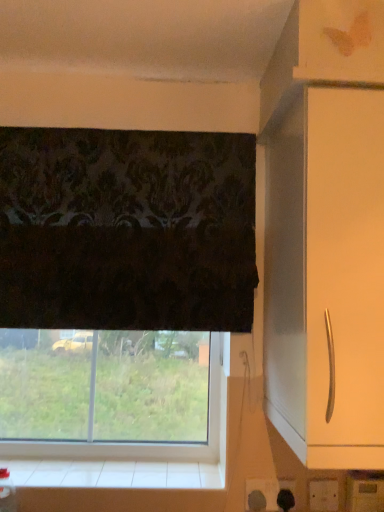
The width and height of the screenshot is (384, 512). I want to click on white glossy cabinet handle at right, so click(344, 279).

Image resolution: width=384 pixels, height=512 pixels. What do you see at coordinates (145, 444) in the screenshot?
I see `transparent glass window at lower center` at bounding box center [145, 444].

Locate an element on the screen. white tile at lower center is located at coordinates (113, 465).

Which object is positioned more to the right, transparent glass window at lower center or white tile at lower center?

From the viewer's perspective, white tile at lower center appears more on the right side.

From a real-world perspective, is transparent glass window at lower center under white tile at lower center?

No, from a real-world perspective, transparent glass window at lower center is not beneath white tile at lower center.

Is transparent glass window at lower center in front of or behind white tile at lower center in the image?

Visually, transparent glass window at lower center is located behind white tile at lower center.

Is transparent glass window at lower center beside white tile at lower center?

Yes, the surface of transparent glass window at lower center is in contact with white tile at lower center.

Which is behind, point (85, 476) or point (136, 452)?

The point (136, 452) is more distant.

Can we say white tile at lower center lies outside transparent glass window at lower center?

Yes, white tile at lower center is not within transparent glass window at lower center.

Looking at the image, does white tile at lower center seem bigger or smaller compared to transparent glass window at lower center?

Clearly, white tile at lower center is smaller in size than transparent glass window at lower center.

From a real-world perspective, is white tile at lower center physically above transparent glass window at lower center?

No.

Between white glossy cabinet handle at right and white tile at lower center, which one has less height?

With less height is white tile at lower center.

Are white glossy cabinet handle at right and white tile at lower center located far from each other?

white glossy cabinet handle at right is actually quite close to white tile at lower center.

Which of these two, white glossy cabinet handle at right or white tile at lower center, is bigger?

white glossy cabinet handle at right.

From the image's perspective, is white glossy cabinet handle at right located above white tile at lower center?

Correct, white glossy cabinet handle at right appears higher than white tile at lower center in the image.

Can you confirm if transparent glass window at lower center is thinner than white glossy cabinet handle at right?

Yes.

Considering the sizes of objects transparent glass window at lower center and white glossy cabinet handle at right in the image provided, who is smaller, transparent glass window at lower center or white glossy cabinet handle at right?

transparent glass window at lower center.

Between point (184, 448) and point (366, 272), which one is positioned behind?

The point (184, 448) is more distant.

Measure the distance from transparent glass window at lower center to white glossy cabinet handle at right.

They are 66.43 centimeters apart.

How many degrees apart are the facing directions of white tile at lower center and white glossy cabinet handle at right?

They differ by 1.06 degrees in their facing directions.

Which of these two, white tile at lower center or white glossy cabinet handle at right, stands taller?

With more height is white glossy cabinet handle at right.

The image size is (384, 512). In order to click on screen door that appears above the white tile at lower center (from the image's perspective) in this screenshot , I will do `click(344, 279)`.

From a real-world perspective, is white glossy cabinet handle at right positioned under transparent glass window at lower center based on gravity?

No, from a real-world perspective, white glossy cabinet handle at right is not beneath transparent glass window at lower center.

Between white glossy cabinet handle at right and transparent glass window at lower center, which one appears on the left side from the viewer's perspective?

transparent glass window at lower center is more to the left.

Is white glossy cabinet handle at right placed right next to transparent glass window at lower center?

No.

What are the coordinates of `window that is behind the white glossy cabinet handle at right` in the screenshot? It's located at (145, 444).

Locate an element on the screen. window sill on the right of transparent glass window at lower center is located at coordinates (113, 465).

I want to click on window sill below the transparent glass window at lower center (from a real-world perspective), so click(x=113, y=465).

Estimate the real-world distances between objects in this image. Which object is further from white glossy cabinet handle at right, white tile at lower center or transparent glass window at lower center?

white tile at lower center.

Based on their spatial positions, is transparent glass window at lower center or white glossy cabinet handle at right further from white tile at lower center?

white glossy cabinet handle at right is further to white tile at lower center.

Estimate the real-world distances between objects in this image. Which object is closer to transparent glass window at lower center, white tile at lower center or white glossy cabinet handle at right?

white tile at lower center is closer to transparent glass window at lower center.

From the image, which object appears to be farther from transparent glass window at lower center, white glossy cabinet handle at right or white tile at lower center?

Based on the image, white glossy cabinet handle at right appears to be further to transparent glass window at lower center.

Considering their positions, is transparent glass window at lower center positioned further to white glossy cabinet handle at right than white tile at lower center?

The object further to white glossy cabinet handle at right is white tile at lower center.

When comparing their distances from white tile at lower center, does white glossy cabinet handle at right or transparent glass window at lower center seem further?

white glossy cabinet handle at right.

This screenshot has width=384, height=512. What are the coordinates of `window sill located between transparent glass window at lower center and white glossy cabinet handle at right in the left-right direction` in the screenshot? It's located at tap(113, 465).